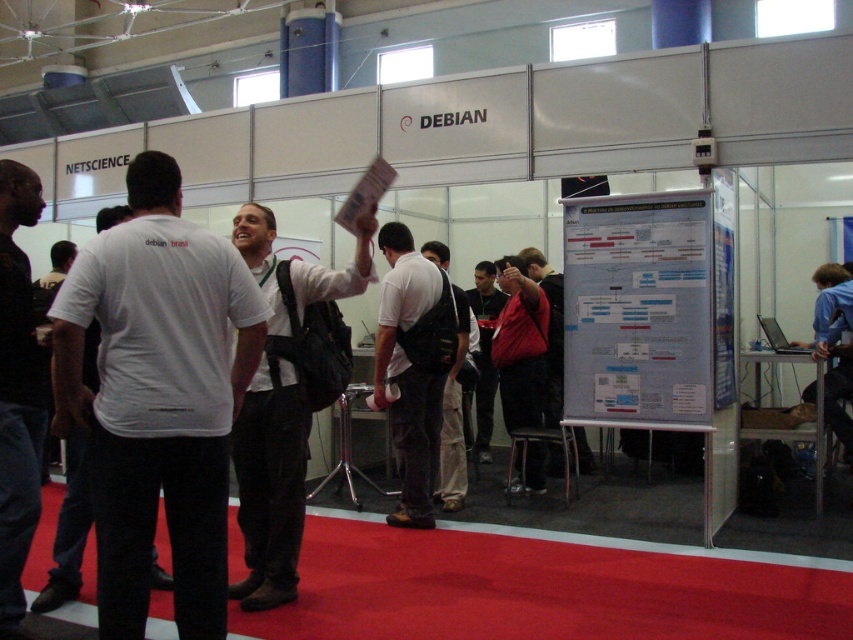
Looking at this image, you are at a tech conference and need to hand out flyers. You see a leather jacket at center and a white paper poster at center. Which object is closer to the left side of the scene?

The leather jacket at center is to the left of the white paper poster at center, so it is closer to the left side of the scene.

You are a conference attendee who wants to read the text on the white paper poster at center. However, there is a person wearing a red jacket at center blocking your view. Can you see the top of the poster?

The white paper poster at center is shorter than the red jacket at center, so the red jacket at center is taller than the poster. Therefore, the person wearing the red jacket at center is blocking the entire poster, making it impossible to see the top of the white paper poster at center.